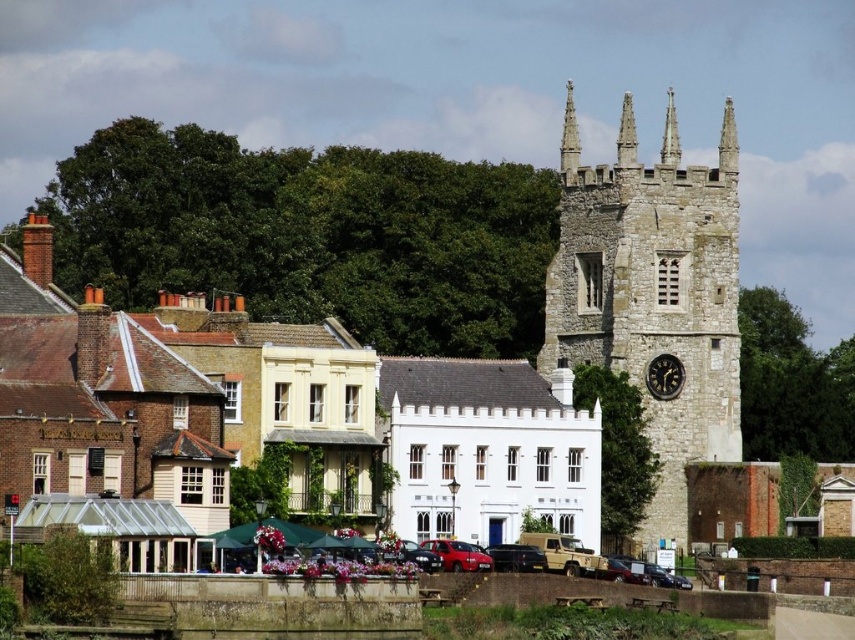
The height and width of the screenshot is (640, 855). Identify the location of stone clock tower at center. (653, 292).

How far apart are stone clock tower at center and black stone clock at right?

They are 6.77 meters apart.

Describe the element at coordinates (653, 292) in the screenshot. This screenshot has width=855, height=640. I see `stone clock tower at center` at that location.

At what (x,y) coordinates should I click in order to perform the action: click on stone clock tower at center. Please return your answer as a coordinate pair (x, y). Looking at the image, I should click on (653, 292).

Describe the element at coordinates (458, 554) in the screenshot. I see `metallic red car at center` at that location.

Measure the distance between metallic red car at center and camera.

A distance of 91.06 meters exists between metallic red car at center and camera.

Identify the location of metallic red car at center. (458, 554).

Is point (638, 384) less distant than point (481, 563)?

No, it is behind (481, 563).

Does stone clock tower at center have a lesser height compared to metallic red car at center?

No.

Is point (699, 445) less distant than point (423, 544)?

No, it is not.

Where is `stone clock tower at center`? stone clock tower at center is located at coordinates (653, 292).